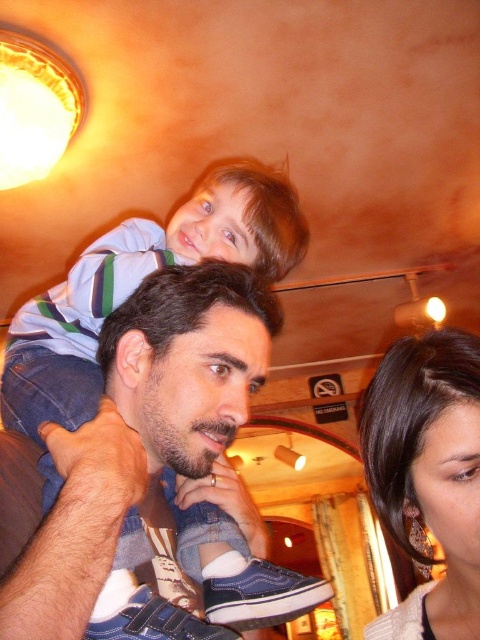
Question: Can you confirm if dark brown hair at center is positioned below satin brown hair at upper right?

Choices:
 (A) no
 (B) yes

Answer: (A)

Question: Which of the following is the closest to the observer?

Choices:
 (A) satin brown hair at upper right
 (B) dark brown hair at center

Answer: (B)

Question: Which object appears farthest from the camera in this image?

Choices:
 (A) dark brown hair at center
 (B) satin brown hair at upper right

Answer: (B)

Question: Can you confirm if dark brown hair at center is wider than satin brown hair at upper right?

Choices:
 (A) yes
 (B) no

Answer: (A)

Question: Where is dark brown hair at center located in relation to satin brown hair at upper right in the image?

Choices:
 (A) left
 (B) right

Answer: (A)

Question: Which object appears closest to the camera in this image?

Choices:
 (A) dark brown hair at center
 (B) satin brown hair at upper right

Answer: (A)